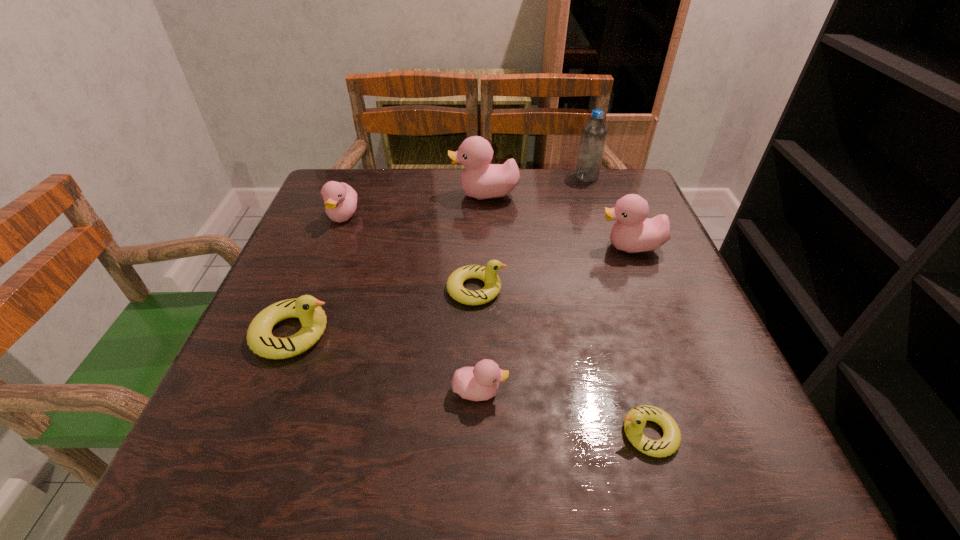
The height and width of the screenshot is (540, 960). In order to click on blue water bottle in this screenshot , I will do `click(594, 132)`.

The image size is (960, 540). I want to click on water bottle, so click(x=594, y=132).

Locate an element on the screen. Image resolution: width=960 pixels, height=540 pixels. the tallest duckling is located at coordinates (480, 180).

Locate an element on the screen. The image size is (960, 540). the second tallest object is located at coordinates (480, 180).

Image resolution: width=960 pixels, height=540 pixels. What are the coordinates of `the sixth shortest duckling` in the screenshot? It's located at (633, 232).

You are a GUI agent. You are given a task and a screenshot of the screen. Output one action in this format:
    pyautogui.click(x=<x>, y=<y>)
    Task: Click on the fourth farthest object
    This screenshot has width=960, height=540.
    Given the screenshot: What is the action you would take?
    point(633,232)

Where is `the third biggest pink duckling`? The width and height of the screenshot is (960, 540). the third biggest pink duckling is located at coordinates (340, 199).

Where is `the leftmost yellow duckling`? The width and height of the screenshot is (960, 540). the leftmost yellow duckling is located at coordinates (307, 308).

Where is `the seventh farthest object`? The image size is (960, 540). the seventh farthest object is located at coordinates (479, 383).

You are a GUI agent. You are given a task and a screenshot of the screen. Output one action in this format:
    pyautogui.click(x=<x>, y=<y>)
    Task: Click on the nearest pink duckling
    This screenshot has width=960, height=540.
    Given the screenshot: What is the action you would take?
    pyautogui.click(x=479, y=383)